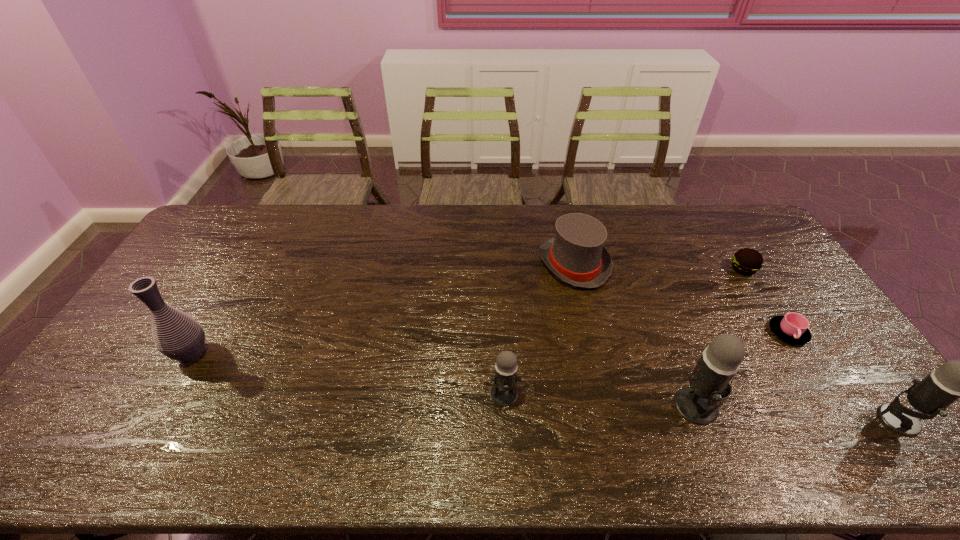
Locate which object is the sixth closest to the fifth tallest object. Please provide its 2D coordinates. Your answer should be formatted as a tuple, i.e. [(x, y)], where the tuple contains the x and y coordinates of a point satisfying the conditions above.

[(177, 335)]

Locate which object is the fifth closest to the patty. Please provide its 2D coordinates. Your answer should be formatted as a tuple, i.e. [(x, y)], where the tuple contains the x and y coordinates of a point satisfying the conditions above.

[(503, 393)]

The image size is (960, 540). What are the coordinates of `microphone that is the closest to the patty` in the screenshot? It's located at (955, 379).

Point out which microphone is positioned as the second nearest to the vase. Please provide its 2D coordinates. Your answer should be formatted as a tuple, i.e. [(x, y)], where the tuple contains the x and y coordinates of a point satisfying the conditions above.

[(699, 403)]

Where is `free space that satisfies the following two spatial constraints: 1. on the front side of the third object from left to right; 2. on the right side of the patty`? This screenshot has width=960, height=540. free space that satisfies the following two spatial constraints: 1. on the front side of the third object from left to right; 2. on the right side of the patty is located at coordinates (575, 269).

This screenshot has width=960, height=540. I want to click on free point that satisfies the following two spatial constraints: 1. on the back side of the fourth object from left to right; 2. on the left side of the patty, so click(643, 269).

Find the location of a particular element. This screenshot has height=540, width=960. vacant region that satisfies the following two spatial constraints: 1. on the front side of the fifth object from right to left; 2. on the left side of the rightmost object is located at coordinates (609, 420).

Locate an element on the screen. blank area in the image that satisfies the following two spatial constraints: 1. on the back side of the fifth tallest object; 2. on the left side of the vase is located at coordinates (243, 264).